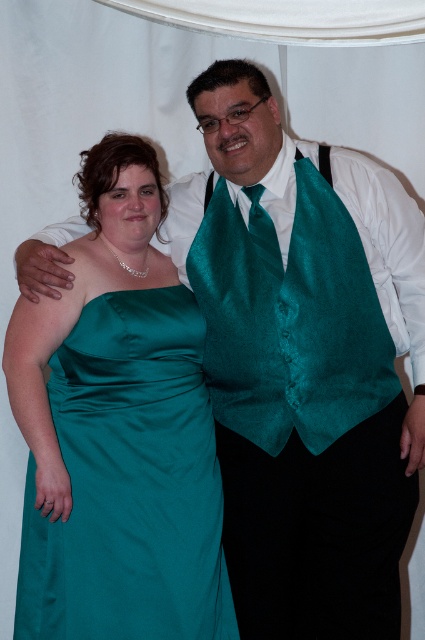
You are a photographer setting up for a group photo. You need to ensure that both the satin teal dress at center and the teal satin vest at center are clearly visible in the frame. Which item should you focus on first to ensure proper exposure, considering their sizes?

The satin teal dress at center has a greater height compared to the teal satin vest at center, so you should focus on the satin teal dress at center first to ensure proper exposure due to its larger size.

You are a photographer trying to frame a photo of the two people in the image. You need to ensure that both the satin teal dress at center and the teal satin vest at center are fully visible. Based on their sizes, which one might require more space in the frame?

The satin teal dress at center might be wider than the teal satin vest at center, so it might require more space in the frame to ensure it is fully visible.

Based on the photo, you are a photographer adjusting the lighting for a photo shoot. You notice the teal satin vest at center and the teal satin tie at center. Which one is positioned lower in the image?

The teal satin vest at center is below the teal satin tie at center, so the vest is positioned lower in the image.